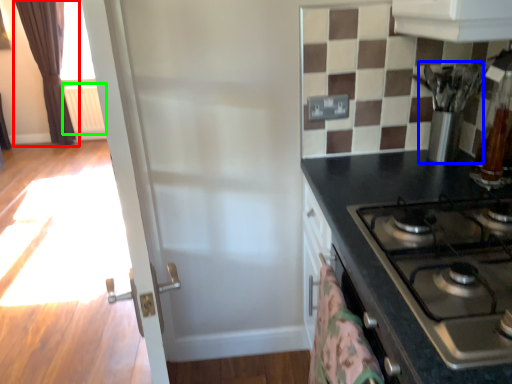
Question: Based on their relative distances, which object is nearer to curtain (highlighted by a red box)? Choose from appliance (highlighted by a blue box) and radiator (highlighted by a green box).

Choices:
 (A) appliance
 (B) radiator

Answer: (B)